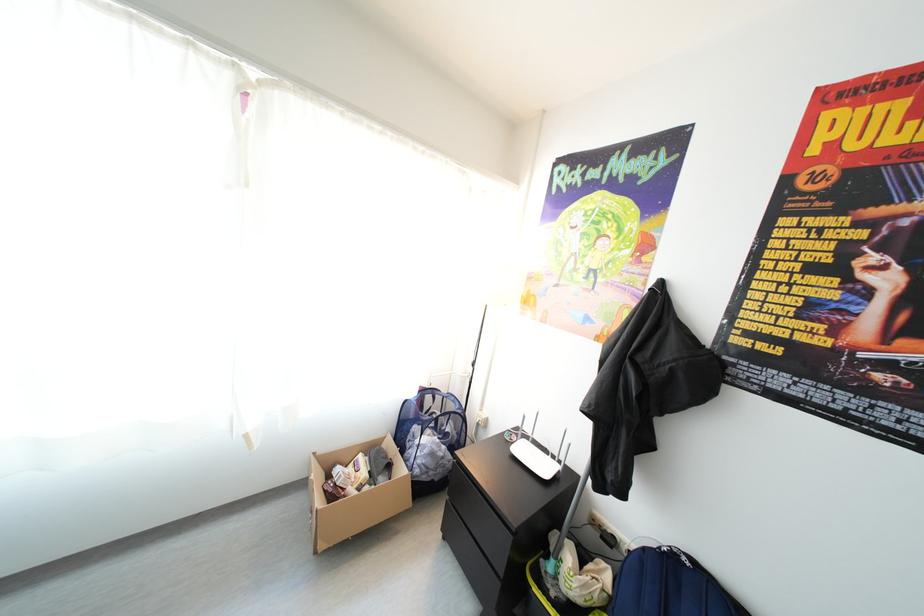
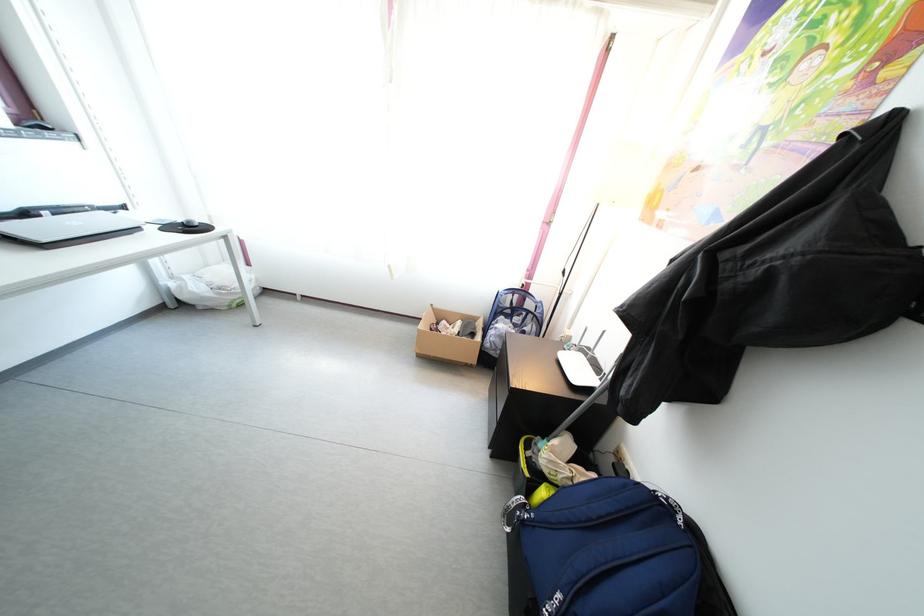
Where in the second image is the point corresponding to point (395, 475) from the first image?

(480, 342)